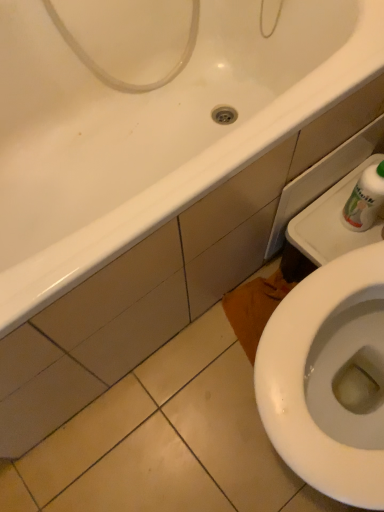
Locate an element on the screen. The image size is (384, 512). white plastic bottle at upper right is located at coordinates (365, 199).

What do you see at coordinates (365, 199) in the screenshot?
I see `white plastic bottle at upper right` at bounding box center [365, 199].

What is the approximate height of white plastic bottle at upper right?

It is 8.74 inches.

Describe the element at coordinates (151, 130) in the screenshot. I see `white glossy bathtub at upper left` at that location.

The height and width of the screenshot is (512, 384). What are the coordinates of `white glossy bathtub at upper left` in the screenshot? It's located at (151, 130).

You are a GUI agent. You are given a task and a screenshot of the screen. Output one action in this format:
    pyautogui.click(x=<x>, y=<y>)
    Task: Click on the white plastic bottle at upper right
    
    Given the screenshot: What is the action you would take?
    pyautogui.click(x=365, y=199)

Which object is positioned more to the left, white plastic bottle at upper right or white glossy bathtub at upper left?

From the viewer's perspective, white glossy bathtub at upper left appears more on the left side.

Is white plastic bottle at upper right closer to the viewer compared to white glossy bathtub at upper left?

No, it is not.

Does point (353, 212) appear closer or farther from the camera than point (79, 279)?

Point (353, 212) is farther from the camera than point (79, 279).

From the image's perspective, which is below, white plastic bottle at upper right or white glossy bathtub at upper left?

From the image's view, white plastic bottle at upper right is below.

From a real-world perspective, relative to white glossy bathtub at upper left, is white plastic bottle at upper right vertically above or below?

Clearly, from a real-world perspective, white plastic bottle at upper right is above white glossy bathtub at upper left.

Between white plastic bottle at upper right and white glossy bathtub at upper left, which one has smaller width?

Thinner between the two is white plastic bottle at upper right.

Who is taller, white plastic bottle at upper right or white glossy bathtub at upper left?

A: Standing taller between the two is white glossy bathtub at upper left.

Can you confirm if white plastic bottle at upper right is smaller than white glossy bathtub at upper left?

Yes, white plastic bottle at upper right is smaller than white glossy bathtub at upper left.

Do you think white plastic bottle at upper right is within white glossy bathtub at upper left, or outside of it?

white plastic bottle at upper right is not enclosed by white glossy bathtub at upper left.

Is white plastic bottle at upper right in contact with white glossy bathtub at upper left?

They are not placed beside each other.

Is white plastic bottle at upper right facing away from white glossy bathtub at upper left?

No.

How different are the orientations of white plastic bottle at upper right and white glossy bathtub at upper left in degrees?

90 degrees separate the facing orientations of white plastic bottle at upper right and white glossy bathtub at upper left.

Identify the location of cleaning product above the white glossy bathtub at upper left (from a real-world perspective). (365, 199).

Visually, is white glossy bathtub at upper left positioned to the left or to the right of white plastic bottle at upper right?

white glossy bathtub at upper left is to the left of white plastic bottle at upper right.

Which object is further away from the camera, white glossy bathtub at upper left or white plastic bottle at upper right?

white plastic bottle at upper right is further away from the camera.

Which is in front, point (29, 42) or point (360, 191)?

Point (360, 191)

From the image's perspective, which object appears higher, white glossy bathtub at upper left or white plastic bottle at upper right?

white glossy bathtub at upper left appears higher in the image.

From a real-world perspective, is white glossy bathtub at upper left physically located above or below white plastic bottle at upper right?

In terms of real-world spatial position, white glossy bathtub at upper left is below white plastic bottle at upper right.

Is white glossy bathtub at upper left thinner than white plastic bottle at upper right?

Incorrect, the width of white glossy bathtub at upper left is not less than that of white plastic bottle at upper right.

Which of these two, white glossy bathtub at upper left or white plastic bottle at upper right, stands taller?

white glossy bathtub at upper left.

Based on the photo, in terms of size, does white glossy bathtub at upper left appear bigger or smaller than white plastic bottle at upper right?

Considering their sizes, white glossy bathtub at upper left takes up more space than white plastic bottle at upper right.

Is white glossy bathtub at upper left situated inside white plastic bottle at upper right or outside?

white glossy bathtub at upper left lies outside white plastic bottle at upper right.

Is there a large distance between white glossy bathtub at upper left and white plastic bottle at upper right?

No.

Is white glossy bathtub at upper left facing towards white plastic bottle at upper right?

Yes.

How far apart are white glossy bathtub at upper left and white plastic bottle at upper right?

white glossy bathtub at upper left and white plastic bottle at upper right are 19.40 inches apart.

This screenshot has width=384, height=512. I want to click on bathtub that is on the left side of white plastic bottle at upper right, so click(x=151, y=130).

The width and height of the screenshot is (384, 512). In order to click on cleaning product lying on the right of white glossy bathtub at upper left in this screenshot , I will do `click(365, 199)`.

At what (x,y) coordinates should I click in order to perform the action: click on bathtub on the left of the white plastic bottle at upper right. Please return your answer as a coordinate pair (x, y). Image resolution: width=384 pixels, height=512 pixels. Looking at the image, I should click on click(151, 130).